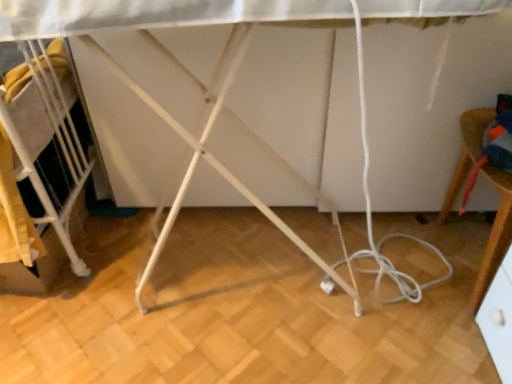
Where is `free area below wooden chair at right (from a real-world perspective)`? The height and width of the screenshot is (384, 512). free area below wooden chair at right (from a real-world perspective) is located at coordinates (460, 253).